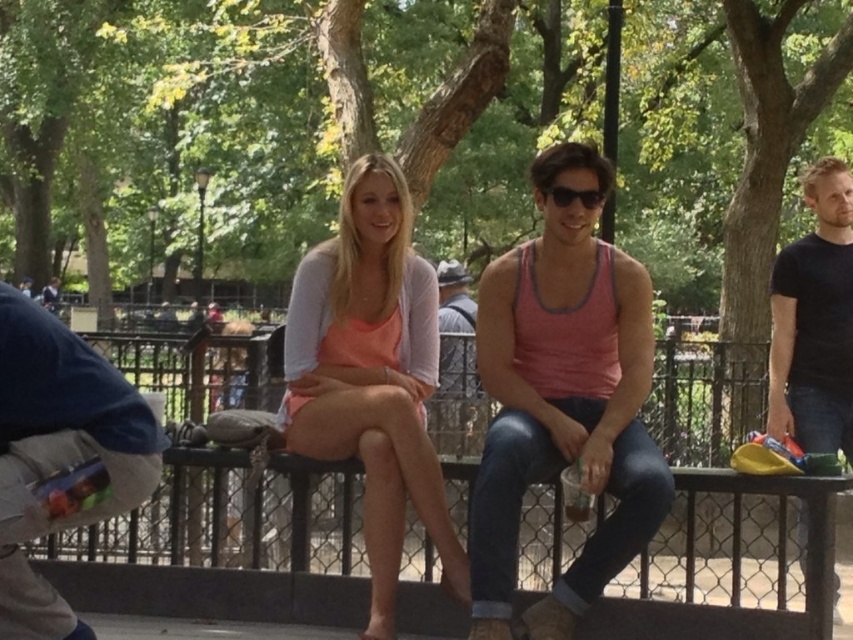
You are standing in the park and see the black metal fence at center and the matte peach tank top at center. Which object is positioned to the right side of the other?

The black metal fence at center is to the right of matte peach tank top at center.

You are a photographer trying to capture a candid shot of the two people sitting on the black metal fence at center. However, you notice the pink fabric tank top at center might be blocking your view. Can you still see the people clearly through the pink fabric tank tank top at center?

The black metal fence at center is not as tall as the pink fabric tank top at center, so the tank top is taller and might block the view of the people behind it. Therefore, you might not be able to see the people clearly through the pink fabric tank top at center.